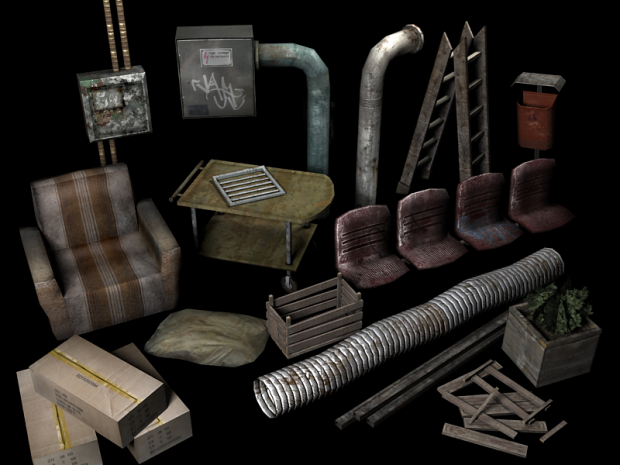
Where is `chairs`? This screenshot has width=620, height=465. chairs is located at coordinates (107, 273), (364, 243), (441, 230), (489, 223), (539, 200).